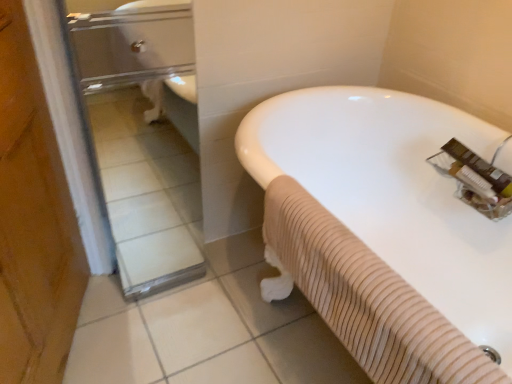
Based on the photo, measure the distance between clear glass door at left and camera.

The depth of clear glass door at left is 1.55 meters.

Describe the element at coordinates (139, 132) in the screenshot. I see `clear glass door at left` at that location.

What is the approximate height of clear glass door at left?

It is 1.01 meters.

The image size is (512, 384). Identify the location of clear glass door at left. (139, 132).

This screenshot has width=512, height=384. I want to click on white rubber bathtub at center, so click(x=385, y=229).

The image size is (512, 384). What do you see at coordinates (385, 229) in the screenshot?
I see `white rubber bathtub at center` at bounding box center [385, 229].

The image size is (512, 384). I want to click on clear glass door at left, so click(139, 132).

Considering the relative positions of white rubber bathtub at center and clear glass door at left in the image provided, is white rubber bathtub at center to the left or to the right of clear glass door at left?

From the image, it's evident that white rubber bathtub at center is to the right of clear glass door at left.

In the scene shown: In the image, is white rubber bathtub at center positioned in front of or behind clear glass door at left?

white rubber bathtub at center is in front of clear glass door at left.

Considering the points (281, 150) and (135, 142), which point is behind, point (281, 150) or point (135, 142)?

The point (135, 142) is behind.

From the image's perspective, is white rubber bathtub at center on top of clear glass door at left?

No, from the image's perspective, white rubber bathtub at center is not above clear glass door at left.

From a real-world perspective, which is physically above, white rubber bathtub at center or clear glass door at left?

clear glass door at left.

Considering the relative sizes of white rubber bathtub at center and clear glass door at left in the image provided, is white rubber bathtub at center thinner than clear glass door at left?

In fact, white rubber bathtub at center might be wider than clear glass door at left.

Does white rubber bathtub at center have a lesser height compared to clear glass door at left?

Indeed, white rubber bathtub at center has a lesser height compared to clear glass door at left.

Is white rubber bathtub at center smaller than clear glass door at left?

Actually, white rubber bathtub at center might be larger than clear glass door at left.

Is white rubber bathtub at center inside the boundaries of clear glass door at left, or outside?

white rubber bathtub at center is located beyond the bounds of clear glass door at left.

Are white rubber bathtub at center and clear glass door at left making contact?

They are not placed beside each other.

Could you tell me if white rubber bathtub at center is facing clear glass door at left?

Yes, white rubber bathtub at center is facing clear glass door at left.

How many degrees apart are the facing directions of white rubber bathtub at center and clear glass door at left?

The angle between the facing direction of white rubber bathtub at center and the facing direction of clear glass door at left is 88 degrees.

Consider the image. Measure the distance from white rubber bathtub at center to clear glass door at left.

white rubber bathtub at center and clear glass door at left are 36.64 inches apart.

Identify the location of glass door on the left of white rubber bathtub at center. The width and height of the screenshot is (512, 384). point(139,132).

Can you confirm if clear glass door at left is positioned to the left of white rubber bathtub at center?

Indeed, clear glass door at left is positioned on the left side of white rubber bathtub at center.

Is clear glass door at left closer to camera compared to white rubber bathtub at center?

No, clear glass door at left is further to the viewer.

Is point (131, 232) farther from camera compared to point (480, 314)?

Yes.

From the image's perspective, between clear glass door at left and white rubber bathtub at center, which one is located above?

clear glass door at left.

From a real-world perspective, between clear glass door at left and white rubber bathtub at center, who is vertically higher?

clear glass door at left is physically above.

Which object is thinner, clear glass door at left or white rubber bathtub at center?

clear glass door at left is thinner.

Which of these two, clear glass door at left or white rubber bathtub at center, stands taller?

With more height is clear glass door at left.

Considering the relative sizes of clear glass door at left and white rubber bathtub at center in the image provided, is clear glass door at left smaller than white rubber bathtub at center?

Correct, clear glass door at left occupies less space than white rubber bathtub at center.

Do you think clear glass door at left is within white rubber bathtub at center, or outside of it?

clear glass door at left cannot be found inside white rubber bathtub at center.

Consider the image. Is clear glass door at left far from white rubber bathtub at center?

That's not correct — clear glass door at left is a little close to white rubber bathtub at center.

Is clear glass door at left oriented towards white rubber bathtub at center?

No, clear glass door at left is not facing towards white rubber bathtub at center.

Locate an element on the screen. bathtub on the right of clear glass door at left is located at coordinates (385, 229).

The image size is (512, 384). What are the coordinates of `glass door located on the left of white rubber bathtub at center` in the screenshot? It's located at (139, 132).

The width and height of the screenshot is (512, 384). In order to click on glass door above the white rubber bathtub at center (from a real-world perspective) in this screenshot , I will do `click(139, 132)`.